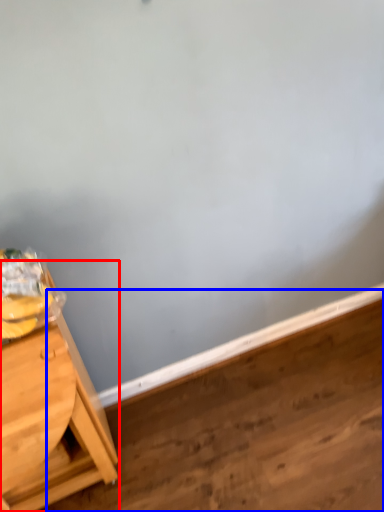
Question: Which of the following is the farthest to the observer, table (highlighted by a red box) or plywood (highlighted by a blue box)?

Choices:
 (A) table
 (B) plywood

Answer: (B)